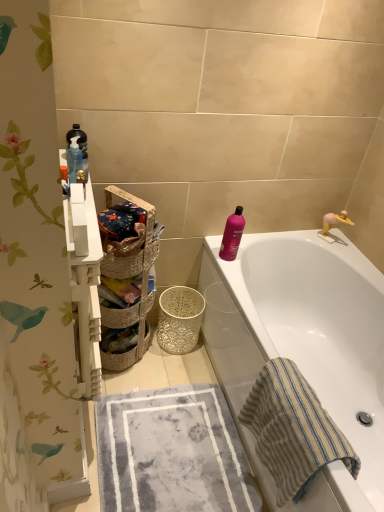
Question: Is woven natural basket at center, positioned as the 1th basket in front-to-back order, located within woven brown basket at center, the first basket when ordered from back to front?

Choices:
 (A) yes
 (B) no

Answer: (B)

Question: Are woven brown basket at center, the first basket when ordered from back to front, and woven natural basket at center, arranged as the second basket when viewed from the back, far apart?

Choices:
 (A) no
 (B) yes

Answer: (A)

Question: Is woven brown basket at center, arranged as the 2th basket when viewed from the front, located outside woven natural basket at center, arranged as the second basket when viewed from the back?

Choices:
 (A) yes
 (B) no

Answer: (A)

Question: From a real-world perspective, is woven brown basket at center, the first basket when ordered from back to front, positioned over woven natural basket at center, arranged as the second basket when viewed from the back, based on gravity?

Choices:
 (A) yes
 (B) no

Answer: (B)

Question: Is woven brown basket at center, the first basket when ordered from back to front, behind woven natural basket at center, arranged as the second basket when viewed from the back?

Choices:
 (A) no
 (B) yes

Answer: (B)

Question: Is woven brown basket at center, the first basket when ordered from back to front, in front of or behind gray textured towel at lower center, positioned as the 2th beach towel in right-to-left order, in the image?

Choices:
 (A) behind
 (B) front

Answer: (A)

Question: Would you say woven brown basket at center, arranged as the 2th basket when viewed from the front, is to the left or to the right of gray textured towel at lower center, positioned as the 2th beach towel in right-to-left order, in the picture?

Choices:
 (A) left
 (B) right

Answer: (A)

Question: From the image's perspective, is woven brown basket at center, arranged as the 2th basket when viewed from the front, above or below gray textured towel at lower center, positioned as the 2th beach towel in right-to-left order?

Choices:
 (A) above
 (B) below

Answer: (A)

Question: Is point (102, 309) positioned closer to the camera than point (112, 486)?

Choices:
 (A) farther
 (B) closer

Answer: (A)

Question: Based on their sizes in the image, would you say woven natural basket at center, arranged as the second basket when viewed from the back, is bigger or smaller than beige striped towel at lower right, which ranks as the first beach towel in right-to-left order?

Choices:
 (A) big
 (B) small

Answer: (B)

Question: Is woven natural basket at center, arranged as the second basket when viewed from the back, taller or shorter than beige striped towel at lower right, the second beach towel viewed from the left?

Choices:
 (A) tall
 (B) short

Answer: (B)

Question: From the image's perspective, relative to beige striped towel at lower right, which ranks as the first beach towel in right-to-left order, is woven natural basket at center, positioned as the 1th basket in front-to-back order, above or below?

Choices:
 (A) above
 (B) below

Answer: (A)

Question: From a real-world perspective, is woven natural basket at center, positioned as the 1th basket in front-to-back order, above or below beige striped towel at lower right, the second beach towel viewed from the left?

Choices:
 (A) below
 (B) above

Answer: (B)

Question: In terms of width, does woven beige basket at left look wider or thinner when compared to gray textured towel at lower center, which is the 1th beach towel in left-to-right order?

Choices:
 (A) wide
 (B) thin

Answer: (B)

Question: Considering the positions of point (130, 263) and point (124, 403), is point (130, 263) closer or farther from the camera than point (124, 403)?

Choices:
 (A) closer
 (B) farther

Answer: (A)